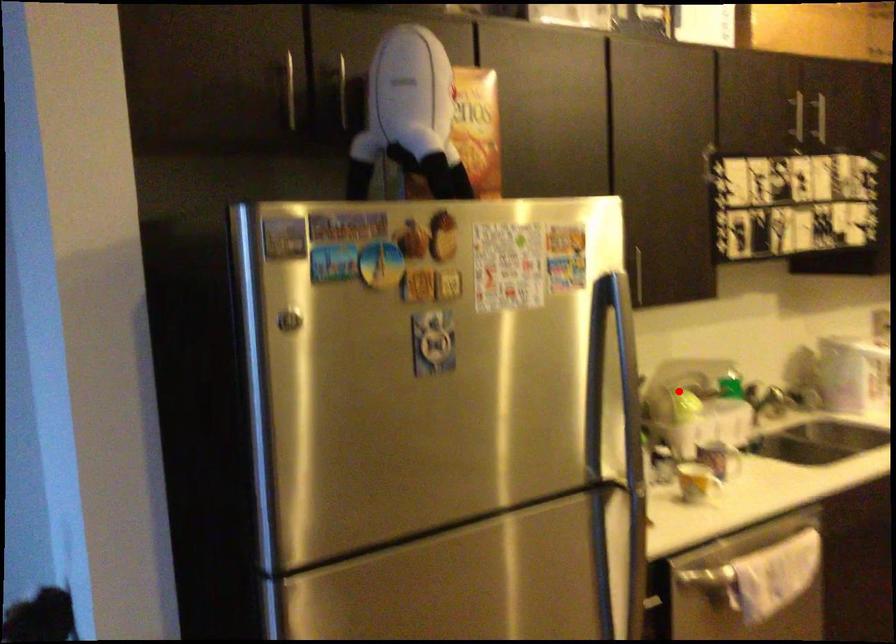
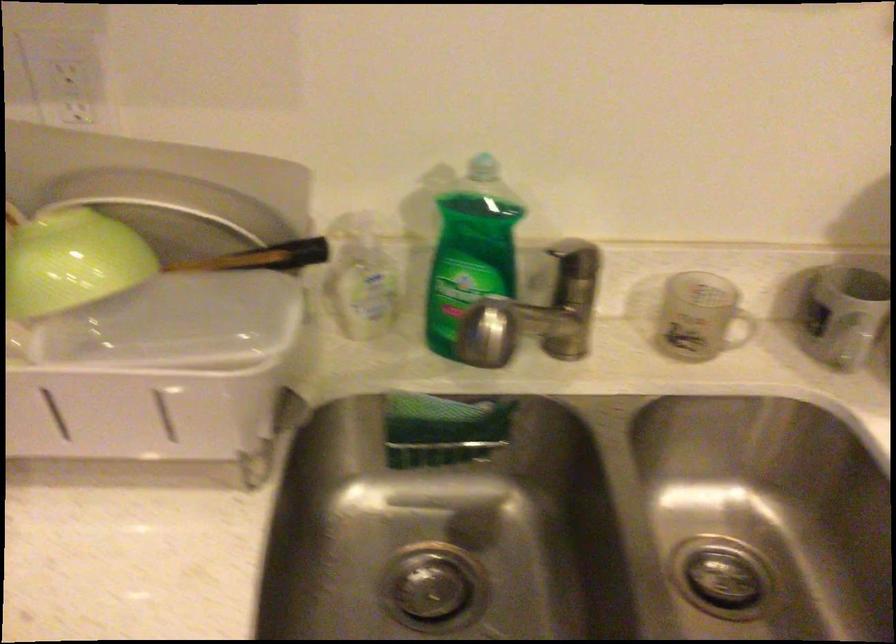
Question: I am providing you with two images of the same scene from different viewpoints. Image1 has a red point marked. In image2, the corresponding 3D location appears at what relative position? Reply with the corresponding letter.

Choices:
 (A) Closer
 (B) Farther

Answer: (A)